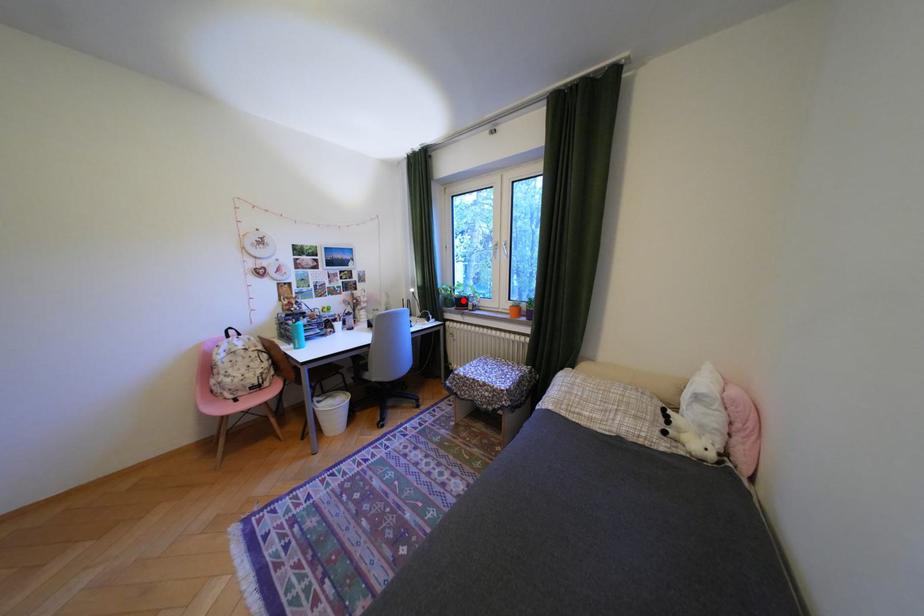
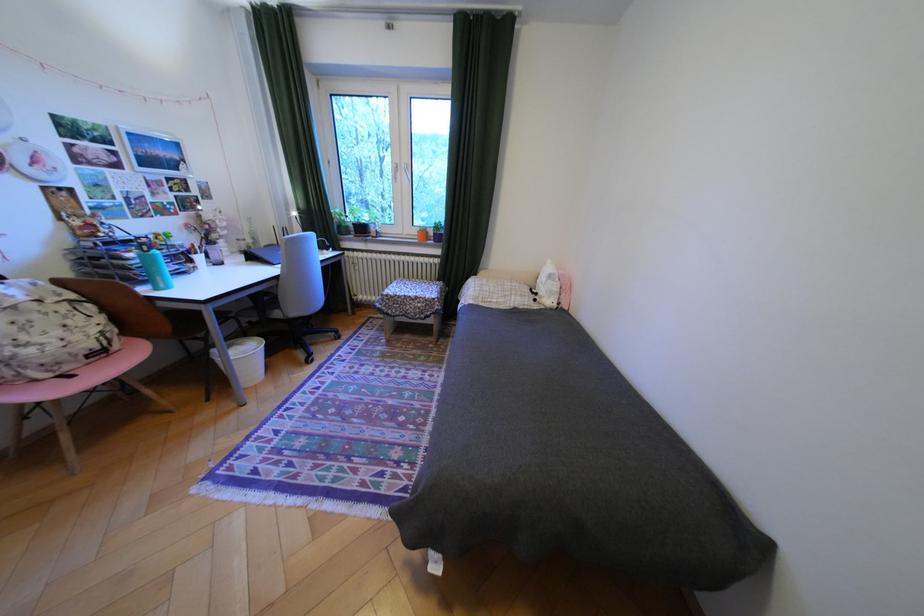
Find the pixel in the second image that matches the highlighted location in the first image.

(359, 227)